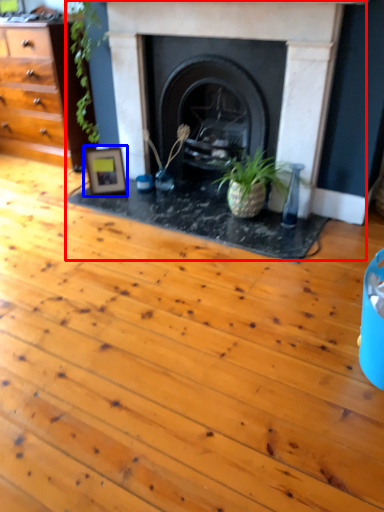
Question: Among these objects, which one is farthest to the camera, fireplace (highlighted by a red box) or picture frame (highlighted by a blue box)?

Choices:
 (A) fireplace
 (B) picture frame

Answer: (B)